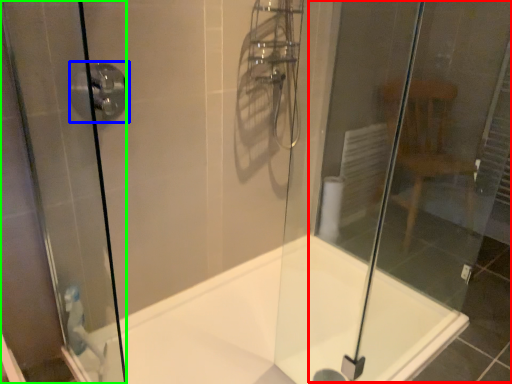
Question: Estimate the real-world distances between objects in this image. Which object is farther from glass door (highlighted by a red box), shower (highlighted by a blue box) or screen door (highlighted by a green box)?

Choices:
 (A) shower
 (B) screen door

Answer: (A)